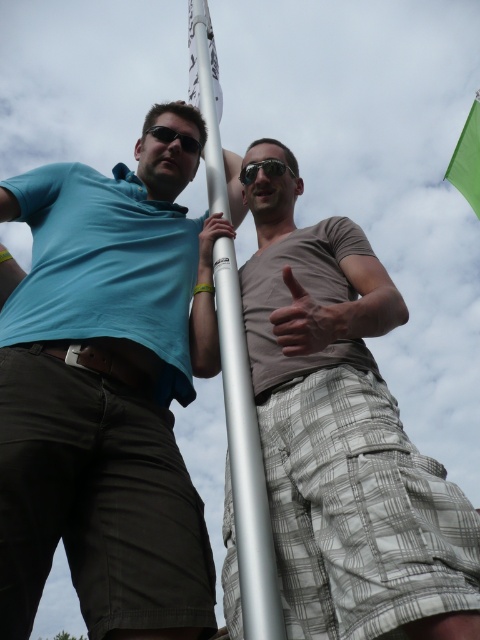
Question: Which point is closer to the camera?

Choices:
 (A) (148, 125)
 (B) (210, 614)

Answer: (B)

Question: Does silver metallic pole at center appear on the right side of matte black sunglasses at upper center?

Choices:
 (A) yes
 (B) no

Answer: (A)

Question: Is silver metallic pole at center smaller than black reflective sunglasses at center?

Choices:
 (A) yes
 (B) no

Answer: (B)

Question: Among these objects, which one is nearest to the camera?

Choices:
 (A) silver metallic pole at center
 (B) matte black sunglasses at upper center
 (C) black reflective sunglasses at center
 (D) green fabric flag at upper right

Answer: (A)

Question: Is matte blue shirt at left above green fabric flag at upper right?

Choices:
 (A) yes
 (B) no

Answer: (B)

Question: Which is farther from the black reflective sunglasses at center?

Choices:
 (A) silver metallic pole at center
 (B) matte black sunglasses at upper center
 (C) matte blue shirt at left
 (D) green fabric flag at upper right

Answer: (D)